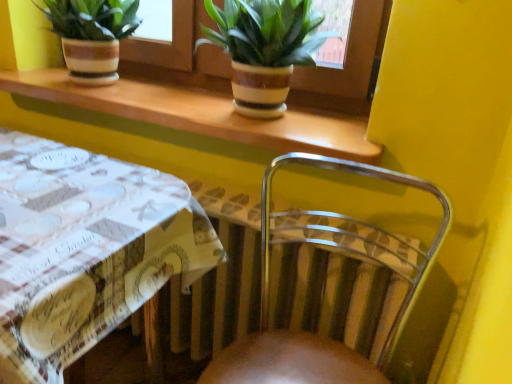
You are a GUI agent. You are given a task and a screenshot of the screen. Output one action in this format:
    pyautogui.click(x=<x>, y=<y>)
    Task: Click on the green leafy plant in striped pot at upper center, acting as the second houseplant starting from the left
    This screenshot has height=384, width=512.
    Given the screenshot: What is the action you would take?
    pyautogui.click(x=264, y=49)

What do you see at coordinates (86, 249) in the screenshot?
I see `white printed fabric at lower left` at bounding box center [86, 249].

What do you see at coordinates (91, 35) in the screenshot? I see `matte striped pot at upper left, the 1th houseplant when ordered from left to right` at bounding box center [91, 35].

The height and width of the screenshot is (384, 512). Identify the location of clear plastic chair at lower right. (328, 290).

How many degrees apart are the facing directions of green leafy plant in striped pot at upper center, the first houseplant positioned from the right, and brown ceramic pots at upper center?

The facing directions of green leafy plant in striped pot at upper center, the first houseplant positioned from the right, and brown ceramic pots at upper center are 0.00541 degrees apart.

Between point (262, 118) and point (330, 79), which one is positioned in front?

The point (262, 118) is closer to the camera.

You are a GUI agent. You are given a task and a screenshot of the screen. Output one action in this format:
    pyautogui.click(x=<x>, y=<y>)
    Task: Click on the houseplant located in front of the brown ceramic pots at upper center
    Image resolution: width=512 pixels, height=384 pixels.
    Given the screenshot: What is the action you would take?
    pyautogui.click(x=264, y=49)

Based on the photo, between green leafy plant in striped pot at upper center, the first houseplant positioned from the right, and brown ceramic pots at upper center, which one has more height?

With more height is brown ceramic pots at upper center.

Does brown ceramic pots at upper center touch white printed fabric at lower left?

No, brown ceramic pots at upper center is not with white printed fabric at lower left.

From the image's perspective, which one is positioned lower, brown ceramic pots at upper center or white printed fabric at lower left?

white printed fabric at lower left.

The width and height of the screenshot is (512, 384). I want to click on table to the left of brown ceramic pots at upper center, so click(86, 249).

Considering the sizes of wooden at upper center and white printed fabric at lower left in the image, is wooden at upper center bigger or smaller than white printed fabric at lower left?

In the image, wooden at upper center appears to be smaller than white printed fabric at lower left.

From the image's perspective, who appears lower, wooden at upper center or white printed fabric at lower left?

white printed fabric at lower left appears lower in the image.

Which object is more forward, wooden at upper center or white printed fabric at lower left?

white printed fabric at lower left is closer to the camera.

Is clear plastic chair at lower right facing towards matte striped pot at upper left, positioned as the second houseplant in right-to-left order?

No, clear plastic chair at lower right is not aimed at matte striped pot at upper left, positioned as the second houseplant in right-to-left order.

In the scene shown: Is clear plastic chair at lower right taller than matte striped pot at upper left, the 1th houseplant when ordered from left to right?

Yes, clear plastic chair at lower right is taller than matte striped pot at upper left, the 1th houseplant when ordered from left to right.

In the scene shown: From the image's perspective, is clear plastic chair at lower right positioned above or below matte striped pot at upper left, positioned as the second houseplant in right-to-left order?

clear plastic chair at lower right is below matte striped pot at upper left, positioned as the second houseplant in right-to-left order.

Between clear plastic chair at lower right and matte striped pot at upper left, positioned as the second houseplant in right-to-left order, which one is positioned behind?

Positioned behind is matte striped pot at upper left, positioned as the second houseplant in right-to-left order.

Would you say brown ceramic pots at upper center is to the left or to the right of green leafy plant in striped pot at upper center, the first houseplant positioned from the right, in the picture?

From the image, it's evident that brown ceramic pots at upper center is to the left of green leafy plant in striped pot at upper center, the first houseplant positioned from the right.

From a real-world perspective, is brown ceramic pots at upper center physically below green leafy plant in striped pot at upper center, the first houseplant positioned from the right?

Actually, brown ceramic pots at upper center is physically above green leafy plant in striped pot at upper center, the first houseplant positioned from the right, in the real world.

Between brown ceramic pots at upper center and green leafy plant in striped pot at upper center, acting as the second houseplant starting from the left, which one has more height?

brown ceramic pots at upper center.

From the picture: Is brown ceramic pots at upper center thinner than green leafy plant in striped pot at upper center, the first houseplant positioned from the right?

Yes.

Is clear plastic chair at lower right far away from brown ceramic pots at upper center?

No, clear plastic chair at lower right is in close proximity to brown ceramic pots at upper center.

Which object is positioned more to the right, clear plastic chair at lower right or brown ceramic pots at upper center?

From the viewer's perspective, clear plastic chair at lower right appears more on the right side.

Would you say clear plastic chair at lower right is outside brown ceramic pots at upper center?

That's correct, clear plastic chair at lower right is outside of brown ceramic pots at upper center.

Between white printed fabric at lower left and matte striped pot at upper left, the 1th houseplant when ordered from left to right, which one has smaller width?

With smaller width is matte striped pot at upper left, the 1th houseplant when ordered from left to right.

Is white printed fabric at lower left taller or shorter than matte striped pot at upper left, the 1th houseplant when ordered from left to right?

white printed fabric at lower left is taller than matte striped pot at upper left, the 1th houseplant when ordered from left to right.

Is the depth of white printed fabric at lower left greater than that of matte striped pot at upper left, the 1th houseplant when ordered from left to right?

No, it is in front of matte striped pot at upper left, the 1th houseplant when ordered from left to right.

How distant is white printed fabric at lower left from matte striped pot at upper left, the 1th houseplant when ordered from left to right?

white printed fabric at lower left and matte striped pot at upper left, the 1th houseplant when ordered from left to right, are 20.99 inches apart from each other.

From the image's perspective, starting from the brown ceramic pots at upper center, which houseplant is the 2nd one below? Please provide its 2D coordinates.

[(264, 49)]

The height and width of the screenshot is (384, 512). In order to click on window frame behind the white printed fabric at lower left in this screenshot , I will do `click(348, 68)`.

Based on their spatial positions, is green leafy plant in striped pot at upper center, acting as the second houseplant starting from the left, or white printed fabric at lower left further from matte striped pot at upper left, positioned as the second houseplant in right-to-left order?

The object further to matte striped pot at upper left, positioned as the second houseplant in right-to-left order, is white printed fabric at lower left.

From the image, which object appears to be farther from white printed fabric at lower left, brown ceramic pots at upper center or clear plastic chair at lower right?

Based on the image, brown ceramic pots at upper center appears to be further to white printed fabric at lower left.

Estimate the real-world distances between objects in this image. Which object is further from clear plastic chair at lower right, white printed fabric at lower left or wooden at upper center?

Among the two, white printed fabric at lower left is located further to clear plastic chair at lower right.

Which object lies nearer to the anchor point brown ceramic pots at upper center, matte striped pot at upper left, positioned as the second houseplant in right-to-left order, or clear plastic chair at lower right?

Based on the image, clear plastic chair at lower right appears to be nearer to brown ceramic pots at upper center.

Based on their spatial positions, is clear plastic chair at lower right or white printed fabric at lower left closer to matte striped pot at upper left, the 1th houseplant when ordered from left to right?

Among the two, white printed fabric at lower left is located nearer to matte striped pot at upper left, the 1th houseplant when ordered from left to right.

Looking at the image, which one is located further to green leafy plant in striped pot at upper center, the first houseplant positioned from the right, wooden at upper center or matte striped pot at upper left, the 1th houseplant when ordered from left to right?

Among the two, matte striped pot at upper left, the 1th houseplant when ordered from left to right, is located further to green leafy plant in striped pot at upper center, the first houseplant positioned from the right.

From the image, which object appears to be nearer to clear plastic chair at lower right, green leafy plant in striped pot at upper center, acting as the second houseplant starting from the left, or white printed fabric at lower left?

The object closer to clear plastic chair at lower right is white printed fabric at lower left.

Looking at the image, which one is located closer to green leafy plant in striped pot at upper center, the first houseplant positioned from the right, matte striped pot at upper left, positioned as the second houseplant in right-to-left order, or brown ceramic pots at upper center?

Among the two, brown ceramic pots at upper center is located nearer to green leafy plant in striped pot at upper center, the first houseplant positioned from the right.

What are the coordinates of `window sill that lies between green leafy plant in striped pot at upper center, acting as the second houseplant starting from the left, and clear plastic chair at lower right from top to bottom` in the screenshot? It's located at (202, 114).

This screenshot has width=512, height=384. Identify the location of houseplant between matte striped pot at upper left, positioned as the second houseplant in right-to-left order, and white printed fabric at lower left, in the vertical direction. (264, 49).

Where is `window sill between matte striped pot at upper left, the 1th houseplant when ordered from left to right, and white printed fabric at lower left vertically`? Image resolution: width=512 pixels, height=384 pixels. window sill between matte striped pot at upper left, the 1th houseplant when ordered from left to right, and white printed fabric at lower left vertically is located at coordinates 202,114.

Identify the location of houseplant between matte striped pot at upper left, the 1th houseplant when ordered from left to right, and clear plastic chair at lower right, in the vertical direction. (264, 49).